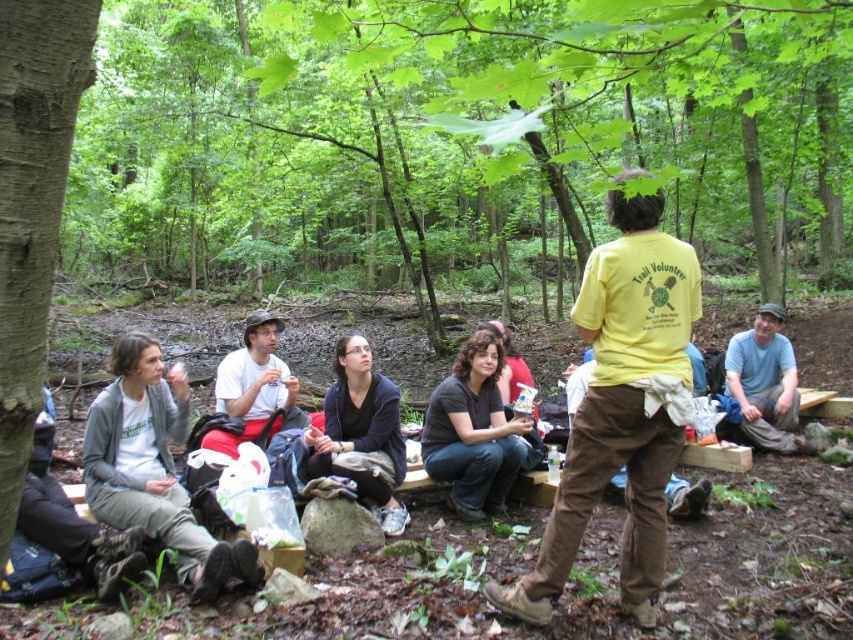
You are an observer standing in the wooded area where the group is gathered. You notice the smooth brown bark at left and the gray fleece jacket at lower left. Which object is positioned more to the right from your perspective?

The smooth brown bark at left is positioned more to the right compared to the gray fleece jacket at lower left.

You are standing in the wooded area and want to walk towards the two points marked in the image. Which point, point (663, 420) or point (180, 364), will you reach first?

Point (663, 420) is closer to the viewer than point (180, 364), so you will reach point (663, 420) first.

Looking at this image, you are a photographer trying to capture a photo of the yellow cotton shirt at center and the gray fleece jacket at lower left. Which clothing item will appear larger in your photo?

The yellow cotton shirt at center will appear larger in the photo because it is closer to the viewer than the gray fleece jacket at lower left.